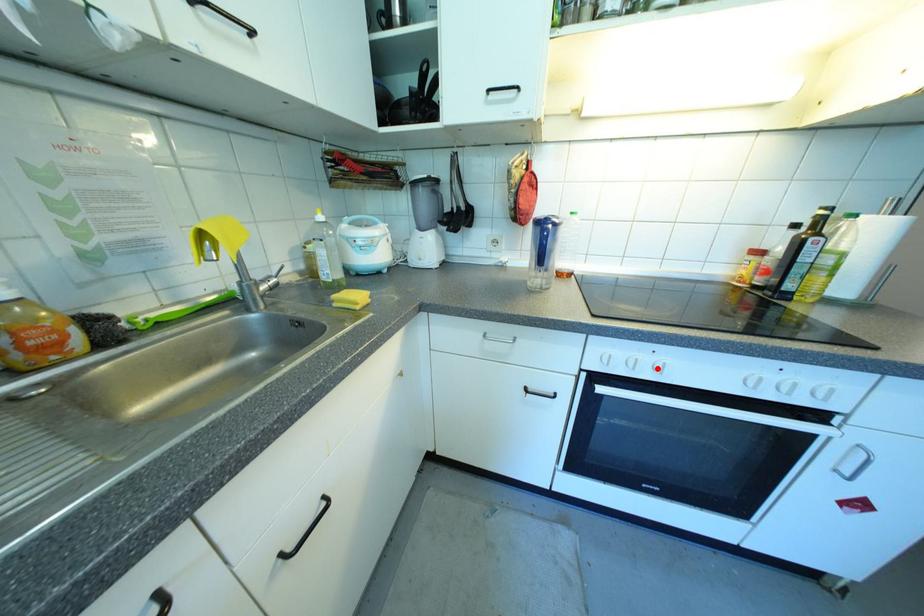
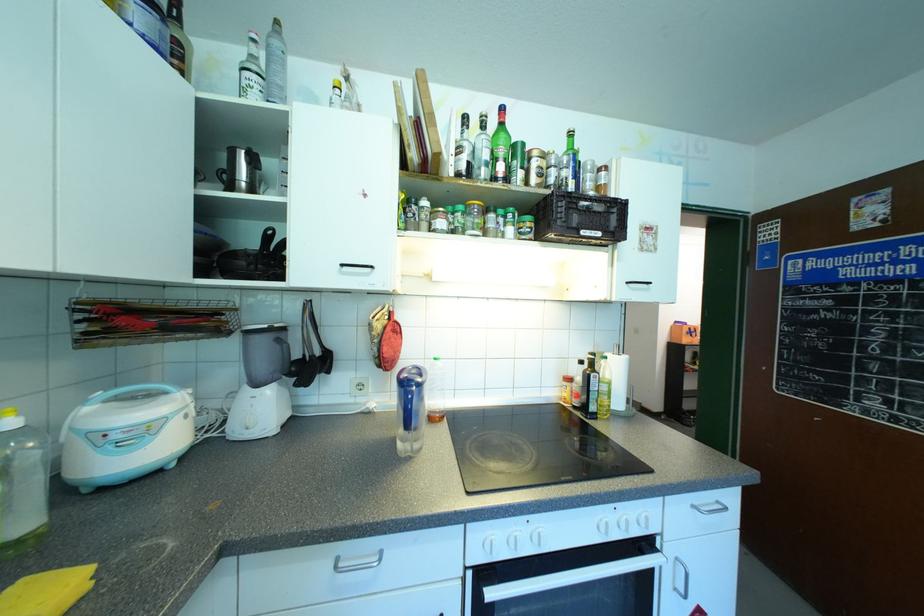
In the second image, find the point that corresponds to the highlighted location in the first image.

(535, 540)